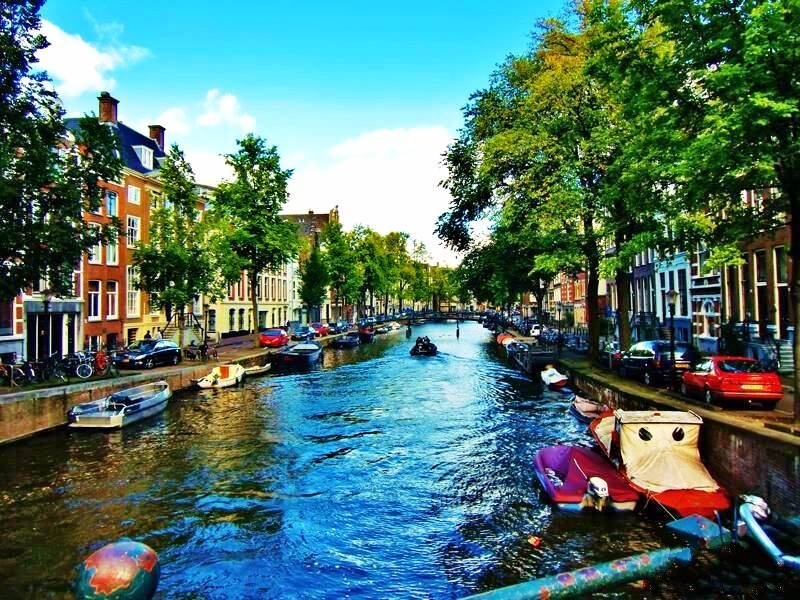
You are a GUI agent. You are given a task and a screenshot of the screen. Output one action in this format:
    pyautogui.click(x=<x>, y=<y>)
    Task: Click on the dormer
    
    Given the screenshot: What is the action you would take?
    pyautogui.click(x=144, y=154)